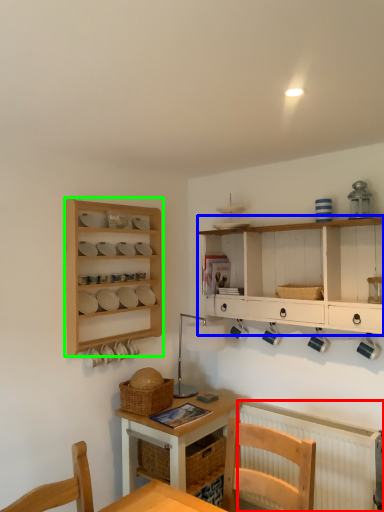
Question: Estimate the real-world distances between objects in this image. Which object is closer to radiator (highlighted by a red box), cabinetry (highlighted by a blue box) or shelf (highlighted by a green box)?

Choices:
 (A) cabinetry
 (B) shelf

Answer: (A)